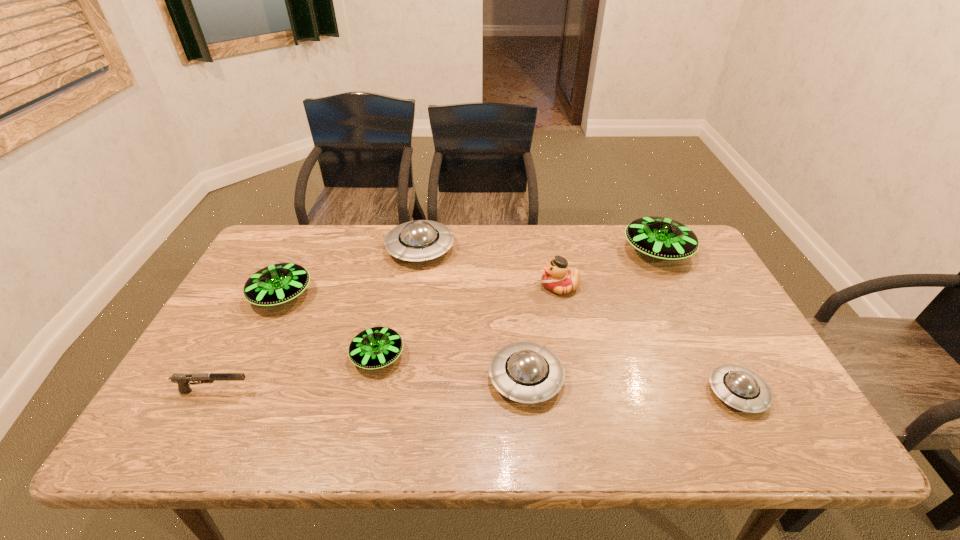
Locate an element on the screen. the second green saucer from left to right is located at coordinates (377, 347).

Identify the location of gun. The height and width of the screenshot is (540, 960). (182, 379).

Identify the location of the smallest gray saucer. The image size is (960, 540). (741, 388).

At what (x,y) coordinates should I click in order to perform the action: click on free space located on the front of the biggest green saucer. Please return your answer as a coordinate pair (x, y). Image resolution: width=960 pixels, height=540 pixels. Looking at the image, I should click on (686, 311).

This screenshot has width=960, height=540. Identify the location of free location located 0.330m on the face of the duck. (429, 286).

This screenshot has height=540, width=960. I want to click on vacant space located on the face of the duck, so click(460, 286).

Locate an element on the screen. This screenshot has height=540, width=960. free spot located 0.090m on the face of the duck is located at coordinates (510, 286).

Locate an element on the screen. free region located 0.290m on the right of the biggest gray saucer is located at coordinates (542, 249).

Locate an element on the screen. This screenshot has height=540, width=960. free space located 0.300m on the front of the third farthest saucer is located at coordinates (223, 414).

Find the location of a particular element. The image size is (960, 540). vacant space located on the right of the fourth saucer from left to right is located at coordinates (696, 379).